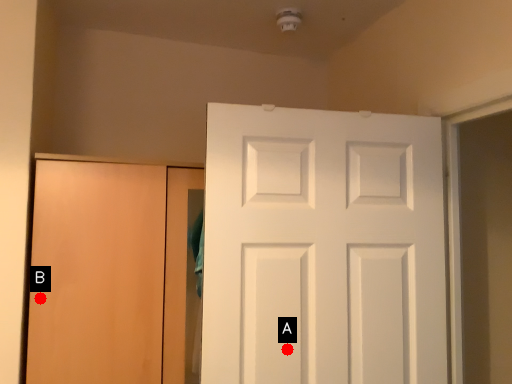
Question: Two points are circled on the image, labeled by A and B beside each circle. Which point is further to the camera?

Choices:
 (A) A is further
 (B) B is further

Answer: (A)